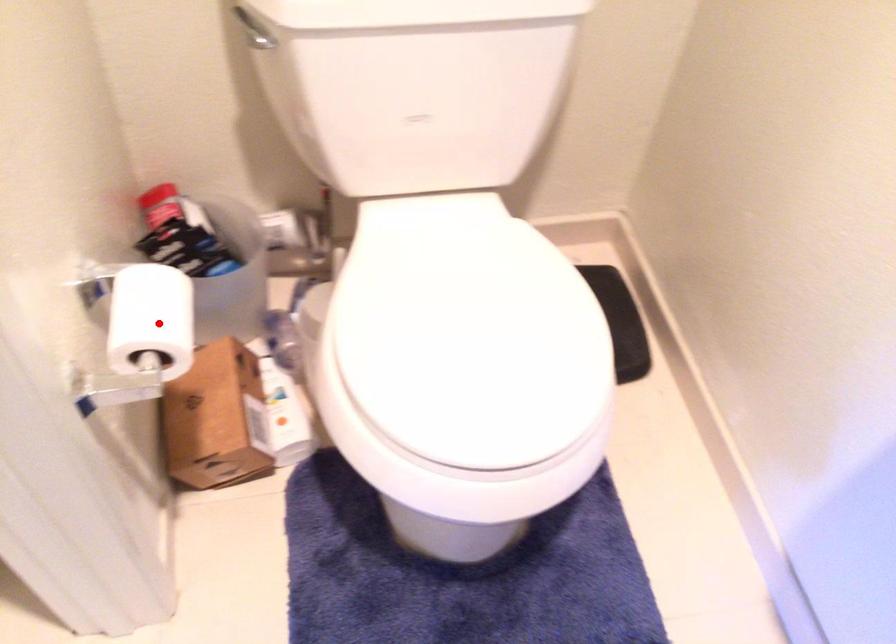
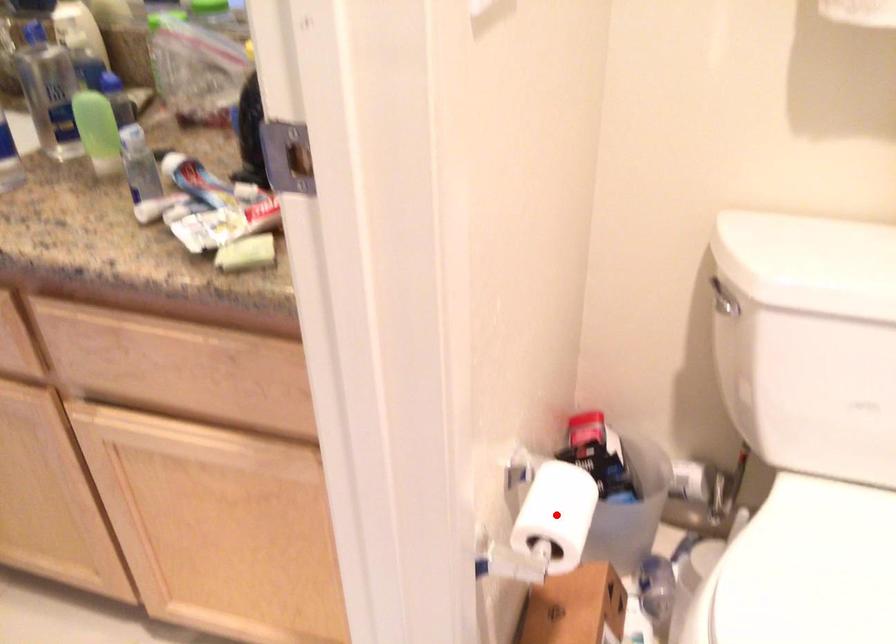
I am providing you with two images of the same scene from different viewpoints. A red point is marked on the first image and another point is marked on the second image. Does the point marked in image1 correspond to the same location as the one in image2?

Yes